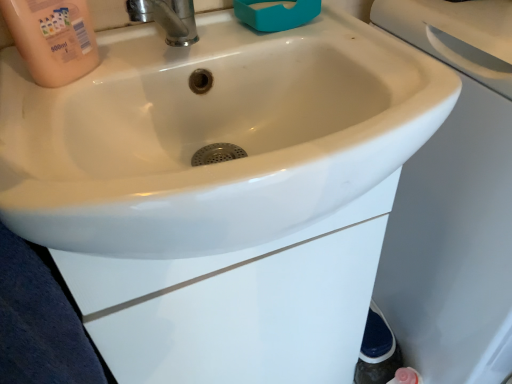
Image resolution: width=512 pixels, height=384 pixels. What do you see at coordinates (212, 135) in the screenshot?
I see `white glossy sink at center` at bounding box center [212, 135].

At what (x,y) coordinates should I click in order to perform the action: click on pink matte bottle at upper left. Please return your answer as a coordinate pair (x, y). Looking at the image, I should click on (53, 38).

Between pink matte bottle at upper left and white glossy sink at center, which one is positioned in front?

white glossy sink at center is more forward.

Consider the image. From a real-world perspective, which object rests below the other?

white glossy sink at center, from a real-world perspective.

Between pink matte bottle at upper left and white glossy sink at center, which one has smaller size?

Smaller between the two is pink matte bottle at upper left.

Considering the points (68, 29) and (139, 2), which point is behind, point (68, 29) or point (139, 2)?

Positioned behind is point (139, 2).

Considering the sizes of objects pink matte bottle at upper left and polished chrome tap at upper center in the image provided, who is shorter, pink matte bottle at upper left or polished chrome tap at upper center?

With less height is polished chrome tap at upper center.

Considering their positions, is pink matte bottle at upper left located in front of or behind polished chrome tap at upper center?

Clearly, pink matte bottle at upper left is in front of polished chrome tap at upper center.

Is pink matte bottle at upper left completely or partially outside of polished chrome tap at upper center?

Absolutely, pink matte bottle at upper left is external to polished chrome tap at upper center.

Is white glossy sink at center at the back of polished chrome tap at upper center?

No, polished chrome tap at upper center is not facing away from white glossy sink at center.

Between polished chrome tap at upper center and white glossy sink at center, which one has larger size?

white glossy sink at center.

Is polished chrome tap at upper center next to white glossy sink at center?

No, polished chrome tap at upper center is not beside white glossy sink at center.

Considering the relative positions of polished chrome tap at upper center and pink matte bottle at upper left in the image provided, is polished chrome tap at upper center to the right of pink matte bottle at upper left from the viewer's perspective?

Yes.

Is pink matte bottle at upper left at the back of polished chrome tap at upper center?

polished chrome tap at upper center does not have its back to pink matte bottle at upper left.

I want to click on tap directly beneath the pink matte bottle at upper left (from a real-world perspective), so click(167, 18).

From the image's perspective, would you say polished chrome tap at upper center is positioned over pink matte bottle at upper left?

Yes, from the image's perspective, polished chrome tap at upper center is over pink matte bottle at upper left.

Is white glossy sink at center oriented away from polished chrome tap at upper center?

white glossy sink at center does not have its back to polished chrome tap at upper center.

From the image's perspective, is white glossy sink at center above or below polished chrome tap at upper center?

Clearly, from the image's perspective, white glossy sink at center is below polished chrome tap at upper center.

Is white glossy sink at center bigger or smaller than polished chrome tap at upper center?

Clearly, white glossy sink at center is larger in size than polished chrome tap at upper center.

At what (x,y) coordinates should I click in order to perform the action: click on sink on the right of pink matte bottle at upper left. Please return your answer as a coordinate pair (x, y). Looking at the image, I should click on (212, 135).

Considering the sizes of objects white glossy sink at center and pink matte bottle at upper left in the image provided, who is wider, white glossy sink at center or pink matte bottle at upper left?

white glossy sink at center is wider.

Is white glossy sink at center facing towards pink matte bottle at upper left?

No.

Which object is further away from the camera taking this photo, white glossy sink at center or pink matte bottle at upper left?

pink matte bottle at upper left is further from the camera.

Find the location of `cleaning product to the left of white glossy sink at center`. cleaning product to the left of white glossy sink at center is located at coordinates (53, 38).

Where is `tap below the pink matte bottle at upper left (from a real-world perspective)`? This screenshot has height=384, width=512. tap below the pink matte bottle at upper left (from a real-world perspective) is located at coordinates (167, 18).

When comparing their distances from polished chrome tap at upper center, does white glossy sink at center or pink matte bottle at upper left seem further?

The object further to polished chrome tap at upper center is white glossy sink at center.

Based on their spatial positions, is polished chrome tap at upper center or white glossy sink at center closer to pink matte bottle at upper left?

Based on the image, polished chrome tap at upper center appears to be nearer to pink matte bottle at upper left.

Which object lies nearer to the anchor point white glossy sink at center, polished chrome tap at upper center or pink matte bottle at upper left?

polished chrome tap at upper center is closer to white glossy sink at center.

Estimate the real-world distances between objects in this image. Which object is closer to polished chrome tap at upper center, pink matte bottle at upper left or white glossy sink at center?

Among the two, pink matte bottle at upper left is located nearer to polished chrome tap at upper center.

Which object lies nearer to the anchor point white glossy sink at center, pink matte bottle at upper left or polished chrome tap at upper center?

polished chrome tap at upper center is closer to white glossy sink at center.

Looking at the image, which one is located closer to pink matte bottle at upper left, white glossy sink at center or polished chrome tap at upper center?

Among the two, polished chrome tap at upper center is located nearer to pink matte bottle at upper left.

The height and width of the screenshot is (384, 512). What are the coordinates of `cleaning product between polished chrome tap at upper center and white glossy sink at center in the up-down direction` in the screenshot? It's located at (53, 38).